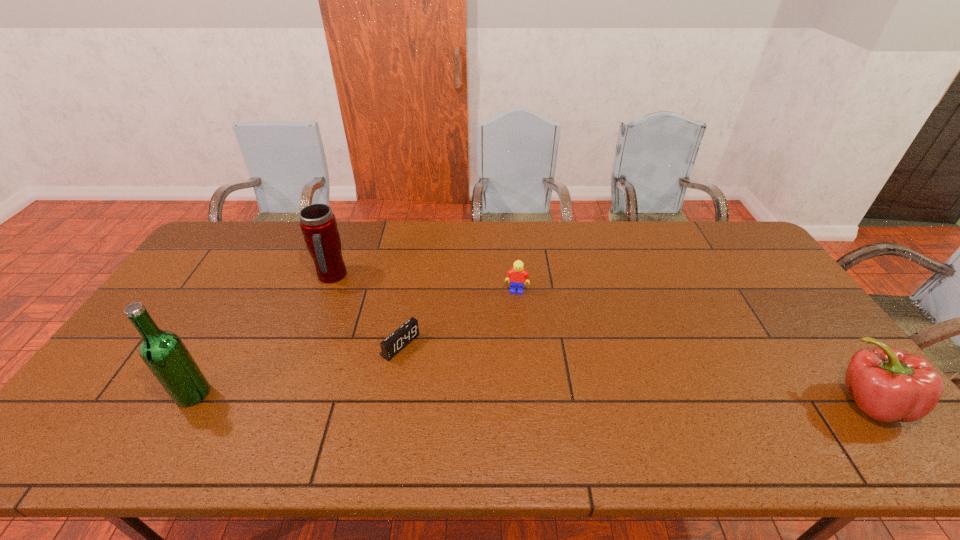
Where is `free space located on the front-facing side of the fourth tallest object`? The height and width of the screenshot is (540, 960). free space located on the front-facing side of the fourth tallest object is located at coordinates (501, 393).

You are a GUI agent. You are given a task and a screenshot of the screen. Output one action in this format:
    pyautogui.click(x=<x>, y=<y>)
    Task: Click on the beer bottle that is at the near edge
    The height and width of the screenshot is (540, 960).
    Given the screenshot: What is the action you would take?
    pyautogui.click(x=164, y=353)

I want to click on pepper at the near edge, so click(887, 384).

Find the location of a particular element. The image size is (960, 540). object located in the right edge section of the desktop is located at coordinates (887, 384).

Where is `object positioned at the near right corner`? This screenshot has width=960, height=540. object positioned at the near right corner is located at coordinates (887, 384).

Find the location of a particular element. free space at the far edge is located at coordinates (380, 235).

Image resolution: width=960 pixels, height=540 pixels. In the image, there is a desktop. Find the location of `vacant space at the near edge`. vacant space at the near edge is located at coordinates (438, 402).

Locate an element on the screen. The width and height of the screenshot is (960, 540). vacant space at the left edge of the desktop is located at coordinates (242, 264).

At what (x,y) coordinates should I click in order to perform the action: click on blank area at the right edge. Please return your answer as a coordinate pair (x, y). Looking at the image, I should click on (737, 264).

The width and height of the screenshot is (960, 540). Find the location of `vacant area at the far left corner`. vacant area at the far left corner is located at coordinates (245, 241).